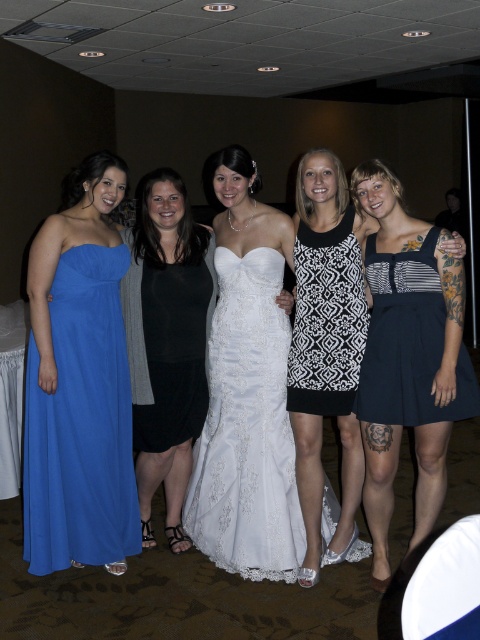
Question: Where is matte blue dress at left located in relation to white lace dress at center in the image?

Choices:
 (A) below
 (B) above

Answer: (B)

Question: Does matte blue dress at left appear on the right side of navy blue cotton dress at right?

Choices:
 (A) yes
 (B) no

Answer: (B)

Question: Based on their relative distances, which object is farther from the black and white printed dress at center?

Choices:
 (A) white lace dress at center
 (B) black and white dress at center
 (C) black matte dress at center

Answer: (C)

Question: Which of these objects is positioned farthest from the matte blue dress at left?

Choices:
 (A) white lace dress at center
 (B) black matte dress at center
 (C) navy blue cotton dress at right
 (D) black and white printed dress at center

Answer: (C)

Question: Does white lace dress at center have a larger size compared to black and white dress at center?

Choices:
 (A) no
 (B) yes

Answer: (B)

Question: Which of the following is the closest to the observer?

Choices:
 (A) navy blue cotton dress at right
 (B) black matte dress at center

Answer: (A)